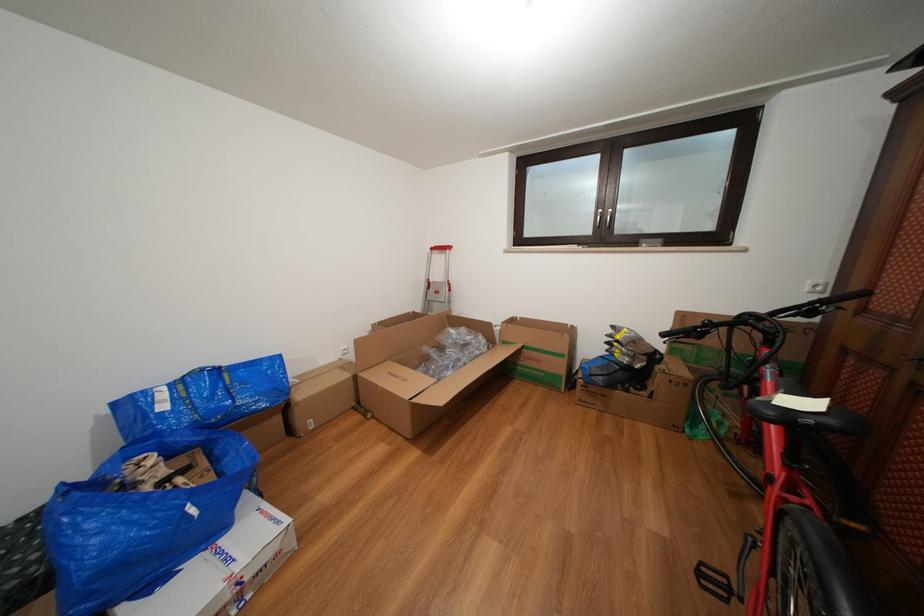
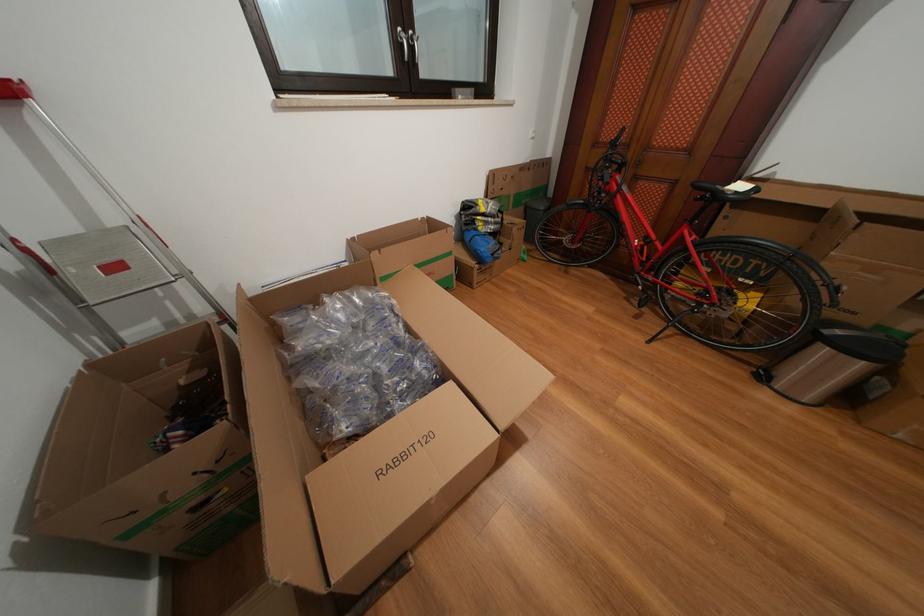
Where in the second image is the point corresponding to point (444, 297) from the first image?

(124, 273)